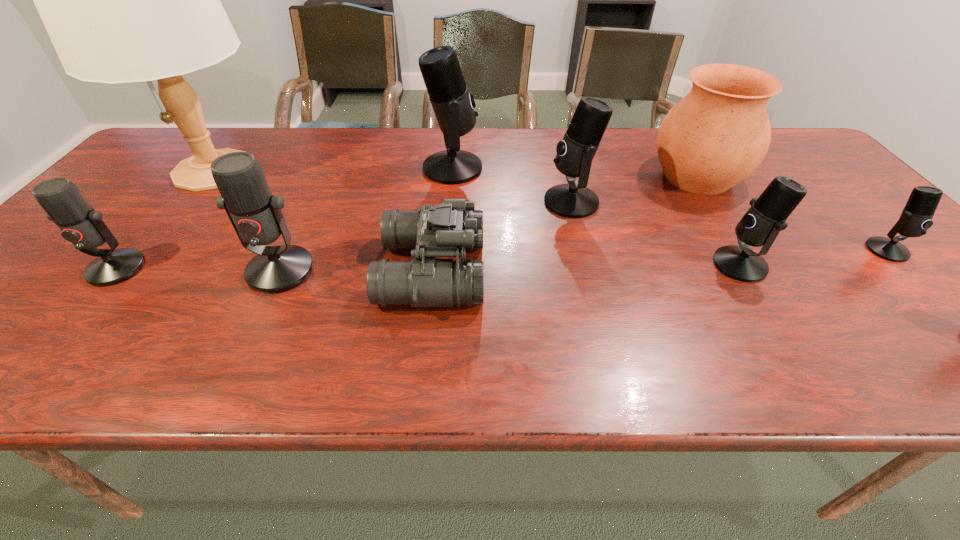
I want to click on microphone that is at the far edge, so click(x=453, y=105).

Image resolution: width=960 pixels, height=540 pixels. What are the coordinates of `pottery located in the far edge section of the desktop` in the screenshot? It's located at (719, 133).

The image size is (960, 540). I want to click on table lamp present at the left edge, so click(123, 0).

What are the coordinates of `microphone situated at the left edge` in the screenshot? It's located at click(x=65, y=205).

The image size is (960, 540). I want to click on object located in the right edge section of the desktop, so click(x=916, y=217).

The image size is (960, 540). I want to click on object positioned at the far left corner, so click(123, 0).

Identify the location of free space at the far edge of the desktop. (431, 133).

I want to click on vacant position at the near edge of the desktop, so click(612, 381).

The image size is (960, 540). I want to click on blank space at the right edge, so click(x=858, y=256).

In the image, there is a desktop. At what (x,y) coordinates should I click in order to perform the action: click on vacant region at the far right corner. Please return your answer as a coordinate pair (x, y). Looking at the image, I should click on (788, 140).